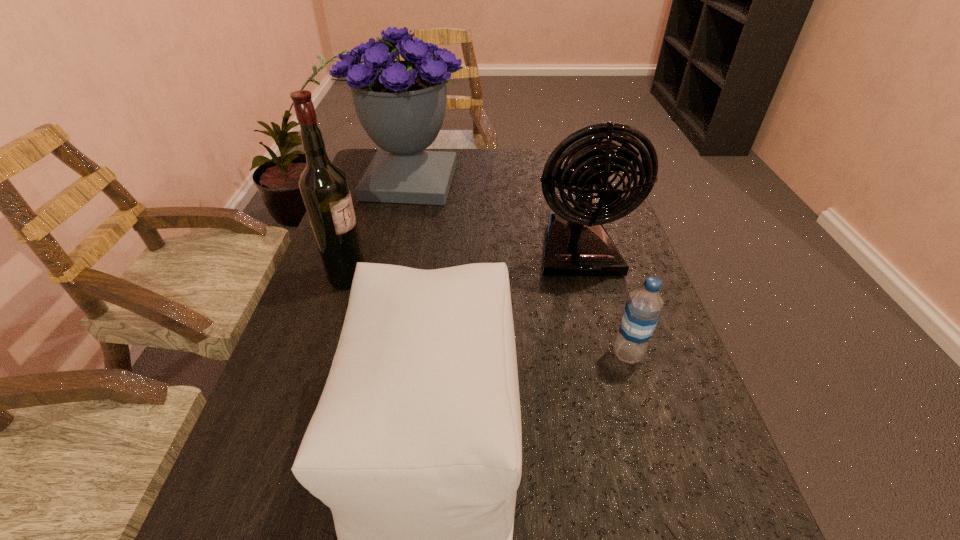
At what (x,y) coordinates should I click in order to perform the action: click on bouquet. Please return your answer as a coordinate pair (x, y). This screenshot has width=960, height=540. Looking at the image, I should click on click(401, 104).

What are the coordinates of `wine bottle` in the screenshot? It's located at (324, 187).

Find the location of a particular element. This screenshot has width=960, height=540. the third tallest object is located at coordinates (577, 244).

This screenshot has width=960, height=540. I want to click on water bottle, so click(642, 310).

Find the location of a particular element. This screenshot has width=960, height=540. free space located 0.230m on the right of the farthest object is located at coordinates (541, 181).

Image resolution: width=960 pixels, height=540 pixels. Identify the location of vacant region located 0.360m on the front and back of the wine bottle. [524, 277].

The image size is (960, 540). I want to click on free space located in front of the third tallest object to blow air, so click(x=602, y=345).

Find the location of a particular element. This screenshot has height=540, width=960. vacant space located on the label of the shortest object is located at coordinates (456, 354).

Where is `free space located on the label of the shortest object`? This screenshot has height=540, width=960. free space located on the label of the shortest object is located at coordinates (492, 354).

Where is `vacant space situated 0.170m on the label of the shortest object`? vacant space situated 0.170m on the label of the shortest object is located at coordinates (524, 354).